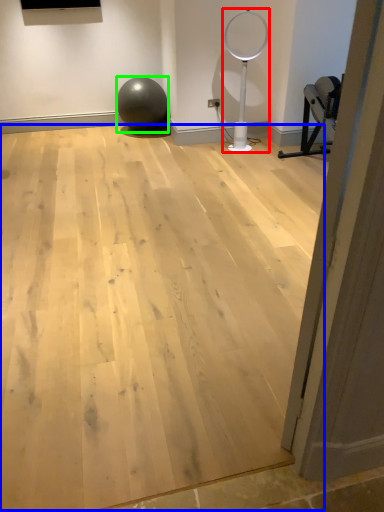
Question: Which object is positioned closest to basketball hoop (highlighted by a red box)? Select from plywood (highlighted by a blue box) and ball (highlighted by a green box).

Choices:
 (A) plywood
 (B) ball

Answer: (B)